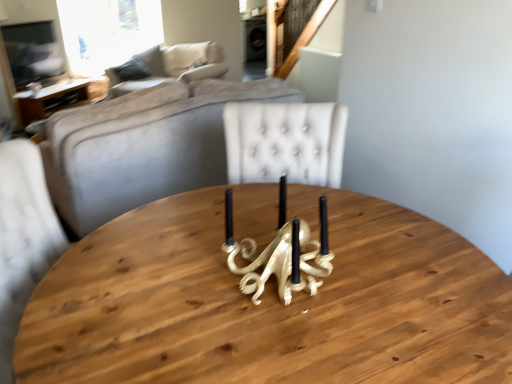
Question: Is gold metallic octopus at center thinner than wooden table at left?

Choices:
 (A) no
 (B) yes

Answer: (B)

Question: Is gold metallic octopus at center positioned in front of wooden table at left?

Choices:
 (A) no
 (B) yes

Answer: (B)

Question: Is wooden table at left a part of gold metallic octopus at center?

Choices:
 (A) no
 (B) yes

Answer: (A)

Question: Is gold metallic octopus at center further to the viewer compared to wooden table at left?

Choices:
 (A) no
 (B) yes

Answer: (A)

Question: Is there a large distance between gold metallic octopus at center and wooden table at left?

Choices:
 (A) no
 (B) yes

Answer: (B)

Question: Is beige fabric couch at upper left to the left or to the right of beige fabric pillow at upper center in the image?

Choices:
 (A) right
 (B) left

Answer: (B)

Question: Relative to beige fabric pillow at upper center, is beige fabric couch at upper left in front or behind?

Choices:
 (A) front
 (B) behind

Answer: (A)

Question: Considering the positions of beige fabric couch at upper left and beige fabric pillow at upper center in the image, is beige fabric couch at upper left bigger or smaller than beige fabric pillow at upper center?

Choices:
 (A) big
 (B) small

Answer: (A)

Question: Choose the correct answer: Is beige fabric couch at upper left inside beige fabric pillow at upper center or outside it?

Choices:
 (A) inside
 (B) outside

Answer: (B)

Question: Visually, is beige fabric couch at upper left positioned to the left or to the right of wooden table at left?

Choices:
 (A) left
 (B) right

Answer: (B)

Question: Is beige fabric couch at upper left taller or shorter than wooden table at left?

Choices:
 (A) short
 (B) tall

Answer: (B)

Question: Is beige fabric couch at upper left bigger or smaller than wooden table at left?

Choices:
 (A) small
 (B) big

Answer: (B)

Question: Does point (144, 49) appear closer or farther from the camera than point (50, 91)?

Choices:
 (A) closer
 (B) farther

Answer: (B)

Question: From a real-world perspective, relative to gold metallic octopus at center, is beige fabric pillow at upper center vertically above or below?

Choices:
 (A) below
 (B) above

Answer: (A)

Question: From the image's perspective, relative to gold metallic octopus at center, is beige fabric pillow at upper center above or below?

Choices:
 (A) below
 (B) above

Answer: (B)